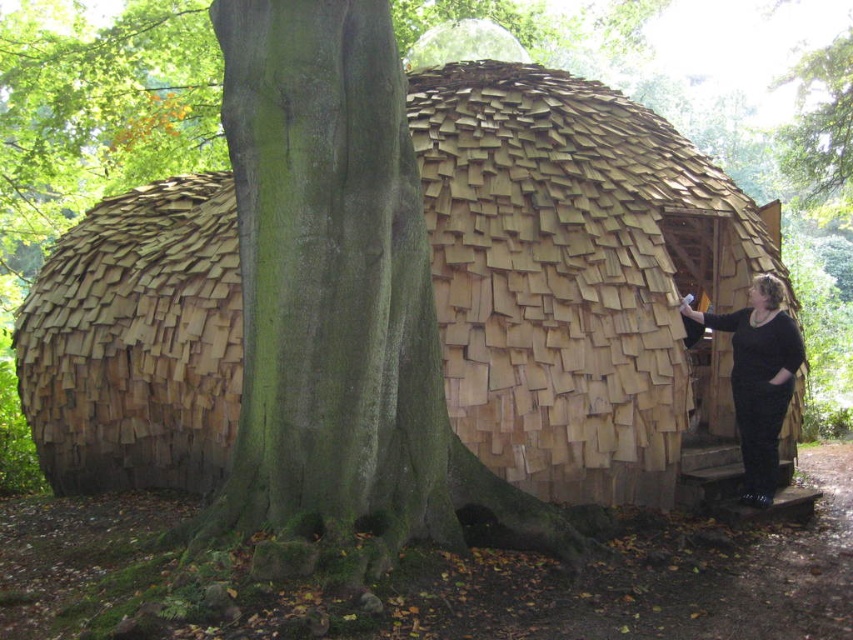
Question: Can you confirm if wooden shingles hut at center is wider than green bark tree at upper center?

Choices:
 (A) no
 (B) yes

Answer: (A)

Question: Is wooden shingles hut at center closer to camera compared to green rough bark tree trunk at center?

Choices:
 (A) no
 (B) yes

Answer: (A)

Question: Which of these objects is positioned closest to the green bark tree at upper center?

Choices:
 (A) green rough bark tree trunk at center
 (B) wooden shingles hut at center
 (C) black matte clothing at right

Answer: (C)

Question: Does green rough bark tree trunk at center lie behind green bark tree at upper center?

Choices:
 (A) no
 (B) yes

Answer: (A)

Question: Which of the following is the closest to the observer?

Choices:
 (A) green rough bark tree trunk at center
 (B) green bark tree at upper center
 (C) black matte clothing at right

Answer: (A)

Question: Which point is farther to the camera?

Choices:
 (A) wooden shingles hut at center
 (B) green rough bark tree trunk at center
 (C) green bark tree at upper center

Answer: (C)